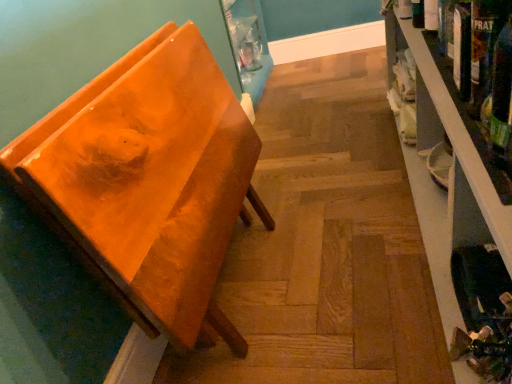
Question: Is wooden shelf at right to the right of green glass bottle at right from the viewer's perspective?

Choices:
 (A) no
 (B) yes

Answer: (B)

Question: From the image's perspective, is wooden shelf at right beneath green glass bottle at right?

Choices:
 (A) no
 (B) yes

Answer: (A)

Question: From a real-world perspective, is wooden shelf at right located higher than green glass bottle at right?

Choices:
 (A) no
 (B) yes

Answer: (A)

Question: Is wooden shelf at right positioned in front of green glass bottle at right?

Choices:
 (A) no
 (B) yes

Answer: (B)

Question: From the image's perspective, is wooden shelf at right above green glass bottle at right?

Choices:
 (A) no
 (B) yes

Answer: (B)

Question: Is point (493, 188) positioned closer to the camera than point (496, 81)?

Choices:
 (A) closer
 (B) farther

Answer: (A)

Question: From their relative heights in the image, would you say wooden shelf at right is taller or shorter than green glass bottle at right?

Choices:
 (A) short
 (B) tall

Answer: (B)

Question: Which is correct: wooden shelf at right is inside green glass bottle at right, or outside of it?

Choices:
 (A) outside
 (B) inside

Answer: (A)

Question: Is wooden shelf at right bigger or smaller than green glass bottle at right?

Choices:
 (A) small
 (B) big

Answer: (B)

Question: Is orange glossy chair at left taller or shorter than wooden shelf at right?

Choices:
 (A) short
 (B) tall

Answer: (B)

Question: Is orange glossy chair at left inside the boundaries of wooden shelf at right, or outside?

Choices:
 (A) outside
 (B) inside

Answer: (A)

Question: Is orange glossy chair at left in front of or behind wooden shelf at right in the image?

Choices:
 (A) behind
 (B) front

Answer: (A)

Question: Is point (124, 273) positioned closer to the camera than point (507, 261)?

Choices:
 (A) closer
 (B) farther

Answer: (B)

Question: In terms of size, does wooden shelf at right appear bigger or smaller than orange glossy chair at left?

Choices:
 (A) big
 (B) small

Answer: (A)

Question: In terms of height, does wooden shelf at right look taller or shorter compared to orange glossy chair at left?

Choices:
 (A) short
 (B) tall

Answer: (A)